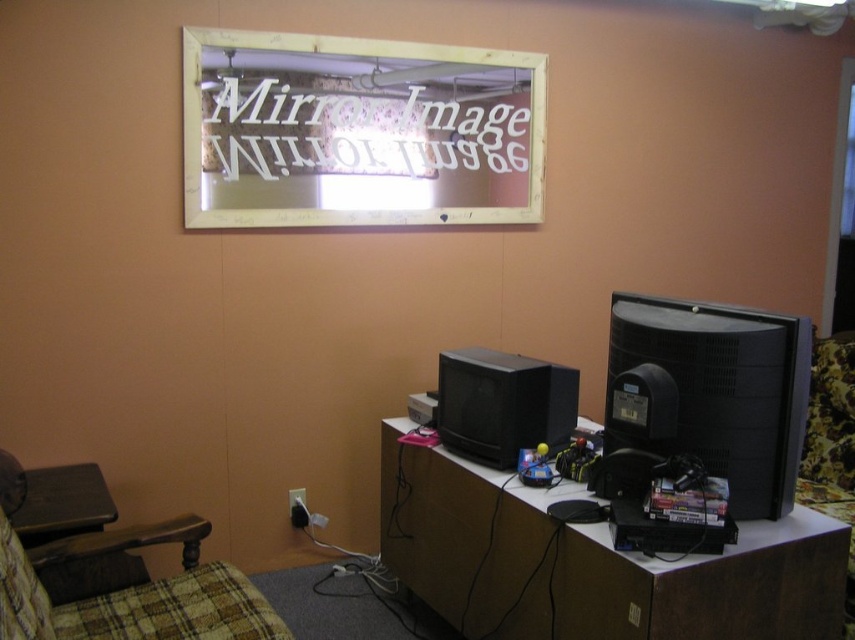
Is gold-framed mirror at upper center thinner than plaid fabric swivel chair at lower left?

No, gold-framed mirror at upper center is not thinner than plaid fabric swivel chair at lower left.

Between gold-framed mirror at upper center and plaid fabric swivel chair at lower left, which one has less height?

Standing shorter between the two is plaid fabric swivel chair at lower left.

The width and height of the screenshot is (855, 640). Identify the location of gold-framed mirror at upper center. (358, 131).

Measure the distance between point (564, 547) and camera.

The distance of point (564, 547) from camera is 1.90 meters.

Which is more to the right, brown wood computer desk at center or plaid fabric swivel chair at lower left?

brown wood computer desk at center

Between point (463, 563) and point (10, 545), which one is positioned in front?

Point (10, 545) is more forward.

Locate an element on the screen. Image resolution: width=855 pixels, height=640 pixels. brown wood computer desk at center is located at coordinates (590, 563).

Can you confirm if black matte computer monitor at right is positioned to the right of plaid fabric swivel chair at lower left?

Indeed, black matte computer monitor at right is positioned on the right side of plaid fabric swivel chair at lower left.

Is black matte computer monitor at right further to the viewer compared to plaid fabric swivel chair at lower left?

Yes, it is.

At what (x,y) coordinates should I click in order to perform the action: click on black matte computer monitor at right. Please return your answer as a coordinate pair (x, y). Looking at the image, I should click on (712, 394).